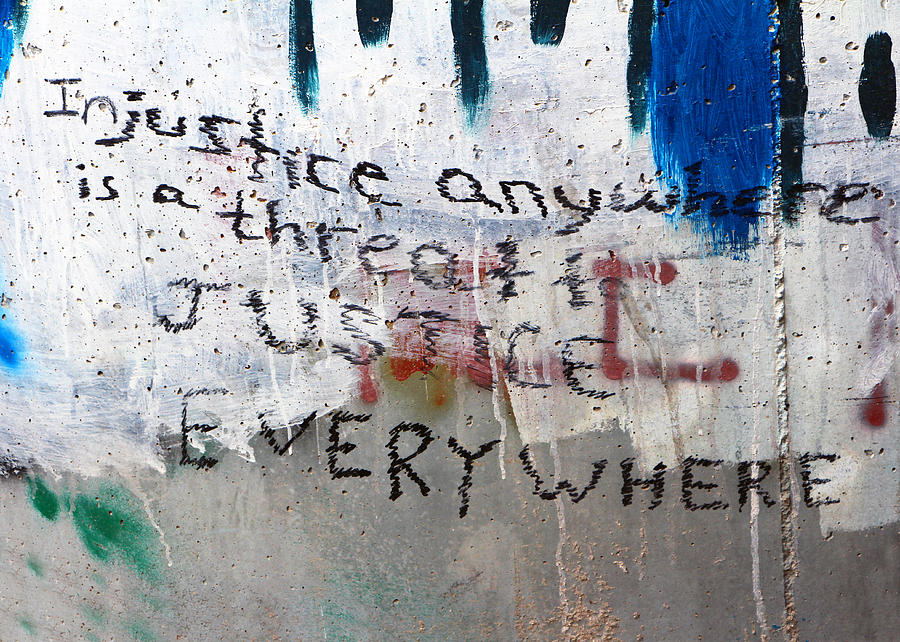
The image size is (900, 642). What are the coordinates of `wall` in the screenshot? It's located at (436, 547).